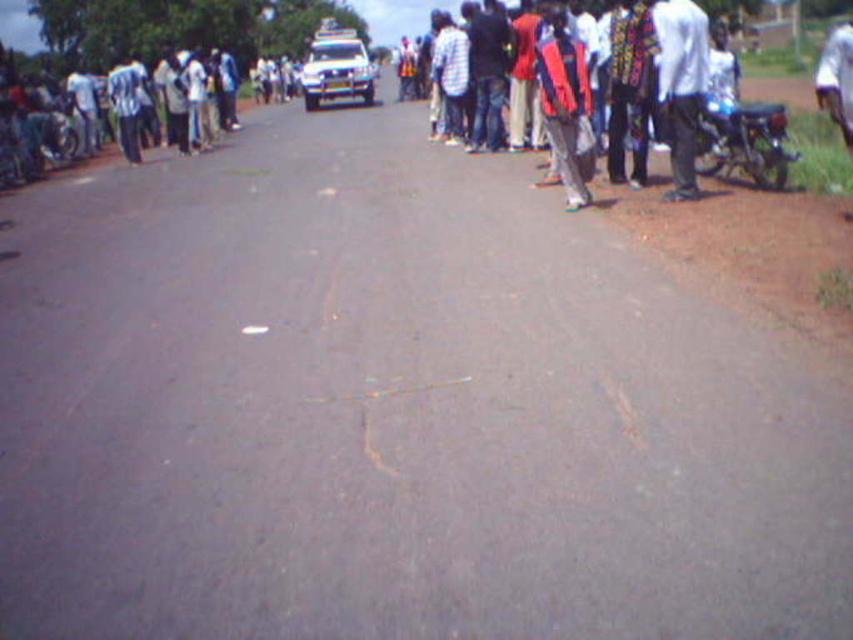
You are a delivery driver who needs to pass through the road. You see the metallic blue motorcycle at right and the gold metallic line at center. Which object is bigger in size?

The metallic blue motorcycle at right is larger in size compared to the gold metallic line at center.

Consider the image. You are a delivery person who needs to park your 1.8 meters tall delivery cart between the metallic blue motorcycle at right and the jeans at center. Can you fit your cart there without overlapping either object?

The metallic blue motorcycle at right is shorter than the jeans at center. Since the cart is 1.8 meters tall, it may not fit vertically if the space between them is constrained by the shorter motorcycle. However, the description only mentions height comparison, not horizontal space. Without information on horizontal distance, we can only confirm the vertical clearance might be insufficient due to the motorcycle being shorter. Thus, it might not fit vertically.